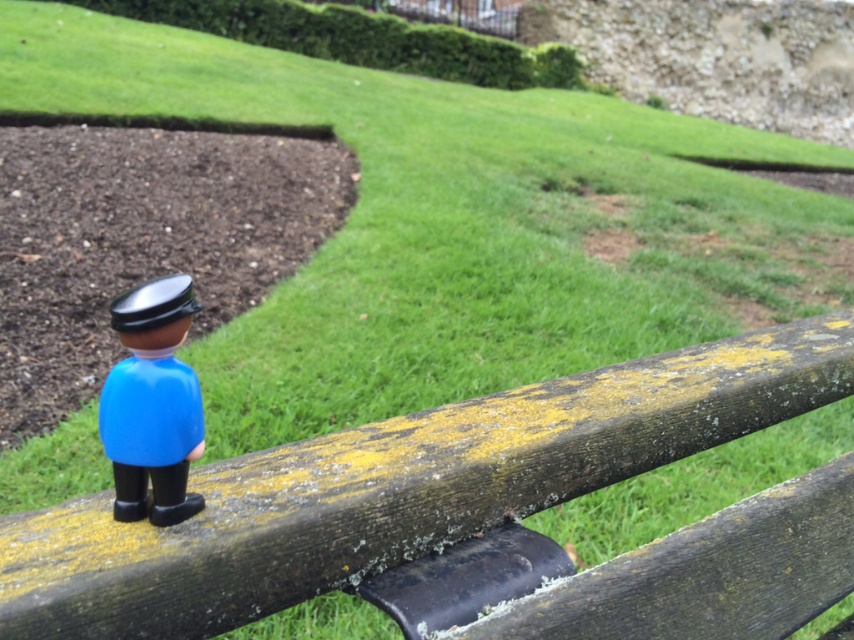
Question: Which point is closer to the camera?

Choices:
 (A) (0, 529)
 (B) (197, 499)

Answer: (A)

Question: Does wooden fence at center come behind blue plastic figurine at lower left?

Choices:
 (A) no
 (B) yes

Answer: (A)

Question: Which of the following is the closest to the observer?

Choices:
 (A) (133, 307)
 (B) (82, 520)

Answer: (A)

Question: Where is wooden fence at center located in relation to blue plastic figurine at lower left in the image?

Choices:
 (A) right
 (B) left

Answer: (A)

Question: Which point appears farthest from the camera in this image?

Choices:
 (A) click(449, 492)
 (B) click(156, 339)

Answer: (A)

Question: From the image, what is the correct spatial relationship of wooden fence at center in relation to blue plastic figurine at lower left?

Choices:
 (A) left
 (B) right

Answer: (B)